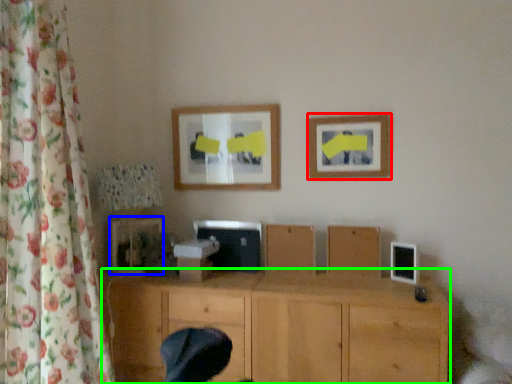
Question: Estimate the real-world distances between objects in this image. Which object is farther from picture frame (highlighted by a red box), picture frame (highlighted by a blue box) or wood (highlighted by a green box)?

Choices:
 (A) picture frame
 (B) wood

Answer: (A)